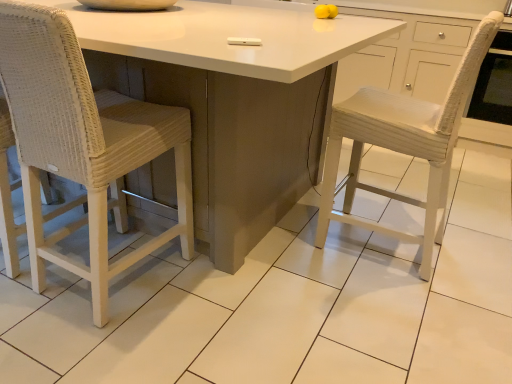
What do you see at coordinates (82, 141) in the screenshot?
I see `woven wicker chair at left` at bounding box center [82, 141].

The image size is (512, 384). I want to click on woven wicker chair at left, so click(82, 141).

Measure the distance between point (212, 207) and camera.

5.32 feet.

I want to click on white glossy table at center, so pyautogui.click(x=230, y=100).

What do you see at coordinates (230, 100) in the screenshot?
I see `white glossy table at center` at bounding box center [230, 100].

Where is `woven wicker chair at left`? woven wicker chair at left is located at coordinates (82, 141).

Is white glossy table at center to the left of woven wicker chair at left from the viewer's perspective?

Correct, you'll find white glossy table at center to the left of woven wicker chair at left.

Which object is closer to the camera, white glossy table at center or woven wicker chair at left?

Positioned in front is white glossy table at center.

Is point (338, 34) in front of point (86, 180)?

No, (338, 34) is further to viewer.

From the image's perspective, does white glossy table at center appear lower than woven wicker chair at left?

No, from the image's perspective, white glossy table at center is not below woven wicker chair at left.

From a real-world perspective, between white glossy table at center and woven wicker chair at left, who is vertically lower?

From a 3D spatial view, white glossy table at center is below.

Does white glossy table at center have a lesser width compared to woven wicker chair at left?

Incorrect, the width of white glossy table at center is not less than that of woven wicker chair at left.

Looking at this image, can you confirm if white glossy table at center is taller than woven wicker chair at left?

Incorrect, the height of white glossy table at center is not larger of that of woven wicker chair at left.

Is white glossy table at center bigger than woven wicker chair at left?

Yes.

Is white glossy table at center inside the boundaries of woven wicker chair at left, or outside?

white glossy table at center is outside woven wicker chair at left.

Does white glossy table at center touch woven wicker chair at left?

No, white glossy table at center is not making contact with woven wicker chair at left.

In the scene shown: Is white glossy table at center aimed at woven wicker chair at left?

Yes.

Image resolution: width=512 pixels, height=384 pixels. I want to click on chair that is below the white glossy table at center (from the image's perspective), so click(x=82, y=141).

Based on the photo, can you confirm if woven wicker chair at left is positioned to the left of white glossy table at center?

Incorrect, woven wicker chair at left is not on the left side of white glossy table at center.

Considering their positions, is woven wicker chair at left located in front of or behind white glossy table at center?

woven wicker chair at left is positioned farther from the viewer than white glossy table at center.

Which is less distant, (92, 154) or (272, 130)?

Point (92, 154) is closer to the camera than point (272, 130).

Consider the image. From the image's perspective, which is below, woven wicker chair at left or white glossy table at center?

From the image's view, woven wicker chair at left is below.

From a real-world perspective, is woven wicker chair at left on top of white glossy table at center?

Yes, from a real-world perspective, woven wicker chair at left is above white glossy table at center.

Can you confirm if woven wicker chair at left is thinner than white glossy table at center?

Yes.

Considering the relative sizes of woven wicker chair at left and white glossy table at center in the image provided, is woven wicker chair at left taller than white glossy table at center?

Yes, woven wicker chair at left is taller than white glossy table at center.

Considering the sizes of objects woven wicker chair at left and white glossy table at center in the image provided, who is bigger, woven wicker chair at left or white glossy table at center?

Bigger between the two is white glossy table at center.

Is woven wicker chair at left outside of white glossy table at center?

Actually, woven wicker chair at left is at least partially inside white glossy table at center.

Is woven wicker chair at left beside white glossy table at center?

woven wicker chair at left and white glossy table at center are clearly separated.

Is woven wicker chair at left facing towards white glossy table at center?

Yes, woven wicker chair at left is facing white glossy table at center.

How distant is woven wicker chair at left from white glossy table at center?

woven wicker chair at left is 34.30 centimeters from white glossy table at center.

Where is `chair located on the right of white glossy table at center`? This screenshot has width=512, height=384. chair located on the right of white glossy table at center is located at coordinates (82, 141).

This screenshot has height=384, width=512. I want to click on table in front of the woven wicker chair at left, so click(230, 100).

In the image, there is a woven wicker chair at left. What are the coordinates of `table below it (from a real-world perspective)` in the screenshot? It's located at tap(230, 100).